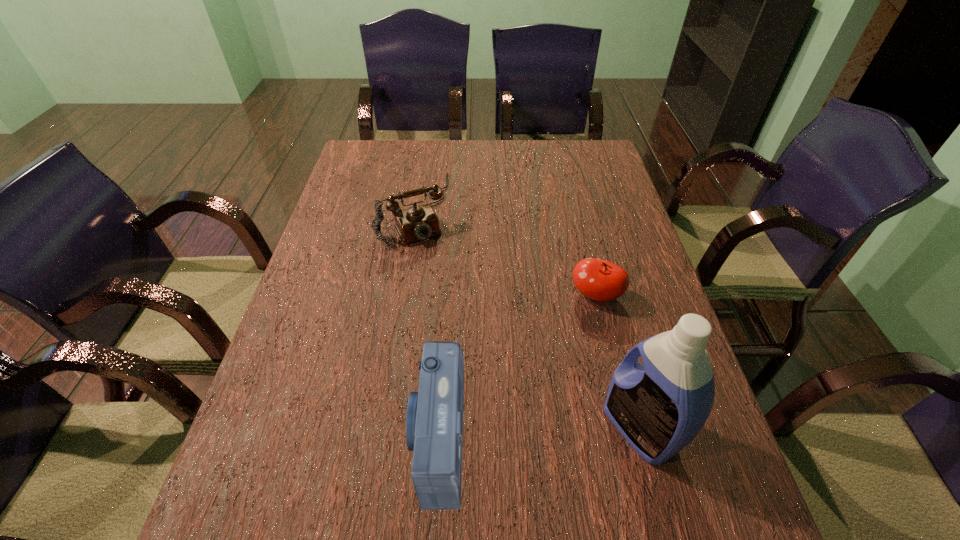
At what (x,y) coordinates should I click in order to perform the action: click on vacant region that satisfies the following two spatial constraints: 1. on the front side of the telephone; 2. on the lens of the camera. Please return your answer as a coordinate pair (x, y). Looking at the image, I should click on (374, 436).